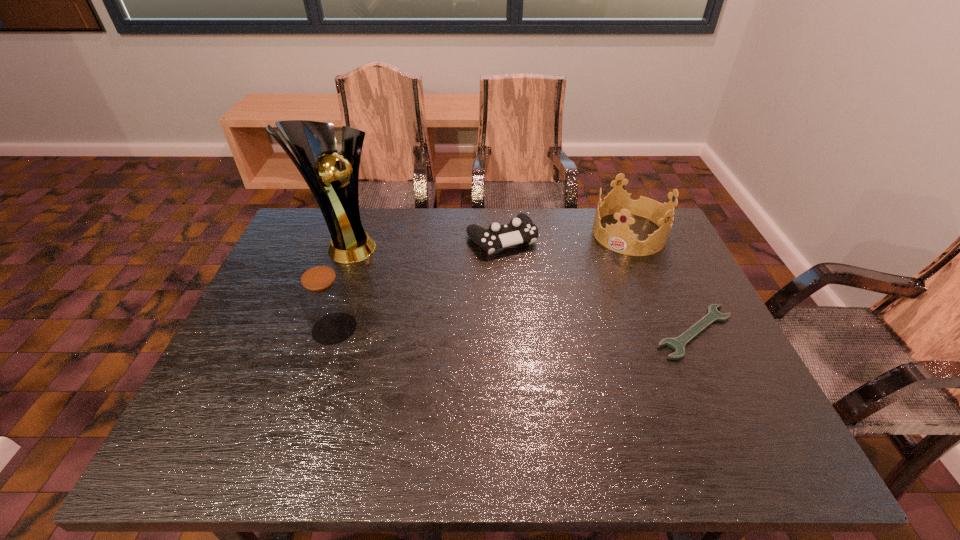
Where is `object that is at the left edge`? The height and width of the screenshot is (540, 960). object that is at the left edge is located at coordinates (313, 143).

Find the location of `wrench that is at the right edge`. wrench that is at the right edge is located at coordinates (678, 343).

Locate an element on the screen. The width and height of the screenshot is (960, 540). tiara positioned at the right edge is located at coordinates pos(618,237).

Where is `object that is at the far left corner`? Image resolution: width=960 pixels, height=540 pixels. object that is at the far left corner is located at coordinates (313, 143).

I want to click on object that is at the far right corner, so click(x=618, y=237).

In the image, there is a desktop. Where is `free region at the far edge`? free region at the far edge is located at coordinates (460, 229).

Where is `blank space at the near edge`? blank space at the near edge is located at coordinates click(x=540, y=388).

Locate an element on the screen. Image resolution: width=960 pixels, height=540 pixels. vacant space at the left edge of the desktop is located at coordinates (264, 316).

Locate an element on the screen. free point at the right edge is located at coordinates (707, 339).

Where is `vacant space at the far left corner of the desktop`? vacant space at the far left corner of the desktop is located at coordinates (291, 241).